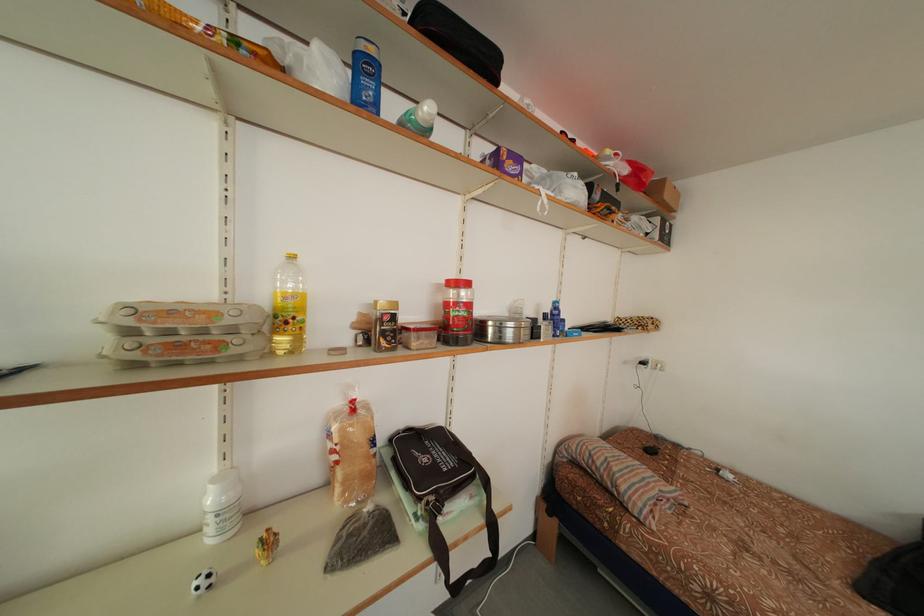
Find the location of a particular element. red container lid is located at coordinates (457, 289).